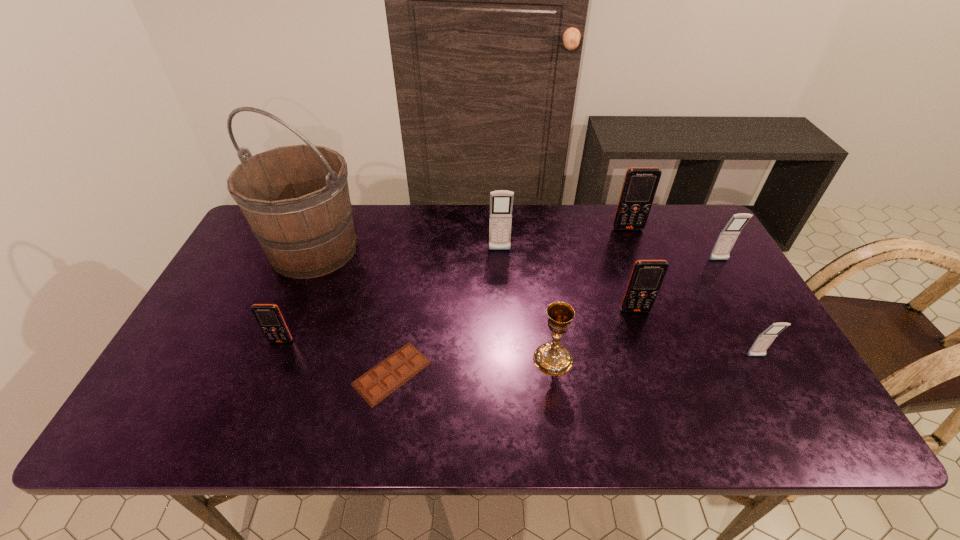
I want to click on blank space at the far edge, so click(x=453, y=236).

Where is `vacant space at the near edge of the desktop`? This screenshot has width=960, height=540. vacant space at the near edge of the desktop is located at coordinates (478, 405).

This screenshot has width=960, height=540. What are the coordinates of `vacant space at the left edge` in the screenshot? It's located at (246, 343).

The height and width of the screenshot is (540, 960). I want to click on vacant area at the right edge of the desktop, so click(x=701, y=256).

Locate an element on the screen. The width and height of the screenshot is (960, 540). free space at the near left corner of the desktop is located at coordinates (204, 418).

This screenshot has width=960, height=540. I want to click on vacant space at the far right corner of the desktop, so click(x=698, y=234).

The image size is (960, 540). Identify the location of vacant area between the nearest gray cellular telephone and the seventh object from right to left. (574, 365).

The width and height of the screenshot is (960, 540). I want to click on vacant point located between the leftmost orange cellular telephone and the third farthest cellular telephone, so click(x=500, y=301).

This screenshot has width=960, height=540. Identify the location of vacant area that lies between the farthest orange cellular telephone and the smallest gray cellular telephone. (692, 293).

The image size is (960, 540). I want to click on vacant space that's between the fifth farthest cellular telephone and the chocolate bar, so coord(337,357).